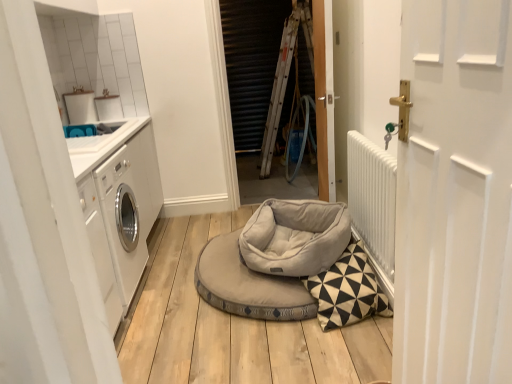
Question: Is light gray plush dog bed at center, which is the second dog bed from bottom to top, at the right side of white glossy washing machine at left?

Choices:
 (A) yes
 (B) no

Answer: (A)

Question: Could you tell me if light gray plush dog bed at center, which is the second dog bed from bottom to top, is turned towards white glossy washing machine at left?

Choices:
 (A) yes
 (B) no

Answer: (B)

Question: Is light gray plush dog bed at center, which is the second dog bed from bottom to top, taller than white glossy washing machine at left?

Choices:
 (A) yes
 (B) no

Answer: (B)

Question: Considering the relative sizes of light gray plush dog bed at center, which ranks as the 1th dog bed in top-to-bottom order, and white glossy washing machine at left in the image provided, is light gray plush dog bed at center, which ranks as the 1th dog bed in top-to-bottom order, wider than white glossy washing machine at left?

Choices:
 (A) no
 (B) yes

Answer: (A)

Question: From the image's perspective, is light gray plush dog bed at center, which ranks as the 1th dog bed in top-to-bottom order, below white glossy washing machine at left?

Choices:
 (A) no
 (B) yes

Answer: (B)

Question: Considering the relative sizes of light gray plush dog bed at center, which ranks as the 1th dog bed in top-to-bottom order, and white glossy washing machine at left in the image provided, is light gray plush dog bed at center, which ranks as the 1th dog bed in top-to-bottom order, thinner than white glossy washing machine at left?

Choices:
 (A) no
 (B) yes

Answer: (B)

Question: Is light gray fabric dog bed at center, marked as the first dog bed in a bottom-to-top arrangement, positioned behind wooden door at center, the first door from the back?

Choices:
 (A) yes
 (B) no

Answer: (B)

Question: Is light gray fabric dog bed at center, the second dog bed when ordered from top to bottom, aimed at wooden door at center, the first door from the back?

Choices:
 (A) no
 (B) yes

Answer: (A)

Question: Are light gray fabric dog bed at center, the second dog bed when ordered from top to bottom, and wooden door at center, placed as the 2th door when sorted from front to back, located far from each other?

Choices:
 (A) yes
 (B) no

Answer: (B)

Question: Does light gray fabric dog bed at center, the second dog bed when ordered from top to bottom, have a smaller size compared to wooden door at center, placed as the 2th door when sorted from front to back?

Choices:
 (A) no
 (B) yes

Answer: (A)

Question: Does light gray fabric dog bed at center, marked as the first dog bed in a bottom-to-top arrangement, have a greater width compared to wooden door at center, the first door from the back?

Choices:
 (A) yes
 (B) no

Answer: (A)

Question: From the image's perspective, would you say light gray fabric dog bed at center, the second dog bed when ordered from top to bottom, is positioned over wooden door at center, the first door from the back?

Choices:
 (A) no
 (B) yes

Answer: (A)

Question: From a real-world perspective, is wooden door at center, the first door from the back, below white textured radiator at right?

Choices:
 (A) no
 (B) yes

Answer: (A)